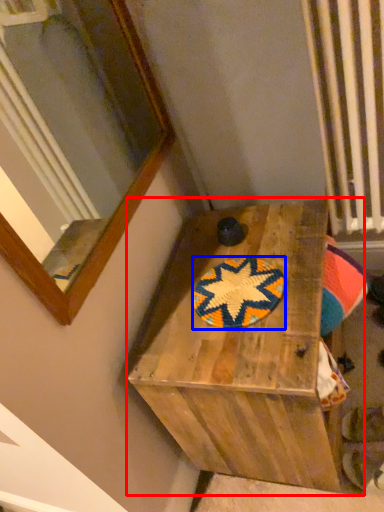
Question: Which point is further to the camera, furniture (highlighted by a red box) or mat (highlighted by a blue box)?

Choices:
 (A) furniture
 (B) mat

Answer: (B)